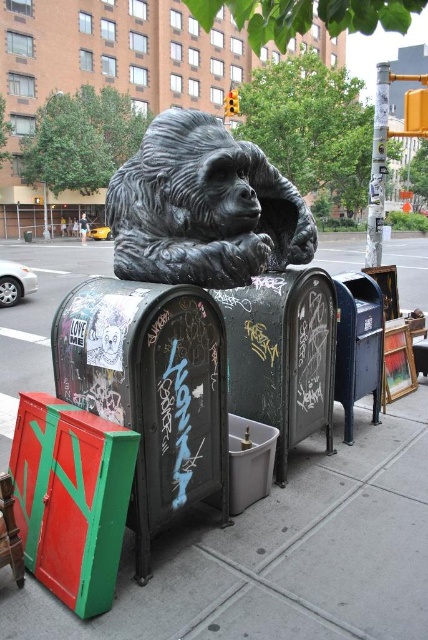
You are a city planner assessing the space between the bronze statue at center and the metallic blue mailbox at right. If the statue is smaller than the mailbox, does this mean the statue takes up less space in the area?

Yes, the bronze statue at center is smaller than the metallic blue mailbox at right, so it takes up less space in the area.

You are standing in front of the gorilla sculpture and want to check both the black textured mailbox at center and the grungy metal mailbox at center. Which mailbox should you approach first to reach the one closer to you?

The black textured mailbox at center is closer to the viewer than the grungy metal mailbox at center, so you should approach the black textured mailbox at center first.

You are a delivery person who needs to place a package on the tallest mailbox between the black textured mailbox at center and the grungy metal mailbox at center. Which mailbox should you choose?

The black textured mailbox at center is much taller than the grungy metal mailbox at center, so you should choose the black textured mailbox at center to place the package.